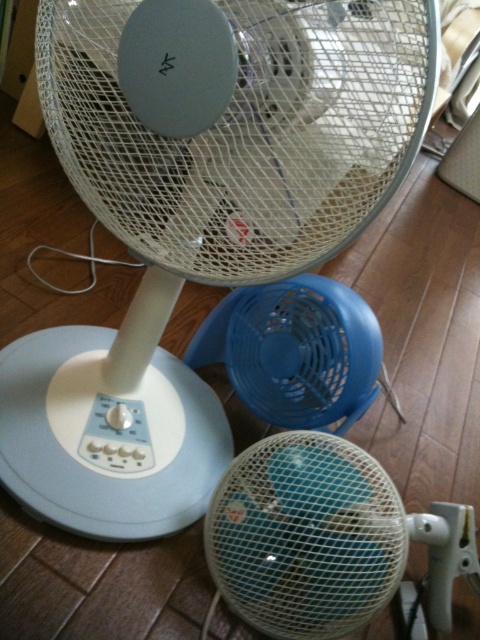
Question: Is blue mesh fan at center below blue plastic fan at center?

Choices:
 (A) no
 (B) yes

Answer: (B)

Question: Which point appears closest to the camera in this image?

Choices:
 (A) (262, 451)
 (B) (325, 326)

Answer: (A)

Question: Does blue mesh fan at center have a smaller size compared to blue plastic fan at center?

Choices:
 (A) yes
 (B) no

Answer: (B)

Question: Is blue mesh fan at center further to the viewer compared to blue plastic fan at center?

Choices:
 (A) yes
 (B) no

Answer: (B)